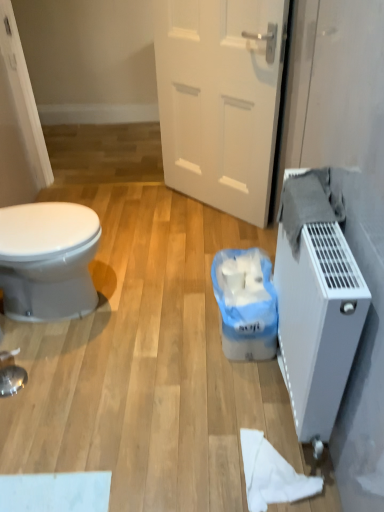
Where is `vacant space situated on the left part of white matte toilet paper at lower right`? This screenshot has width=384, height=512. vacant space situated on the left part of white matte toilet paper at lower right is located at coordinates (207, 461).